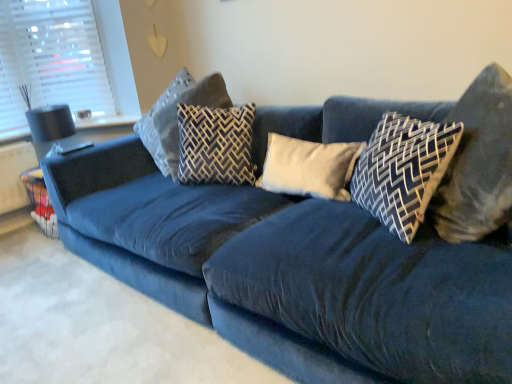
Question: Which is correct: white plastic blinds at upper left is inside dark gray fabric pillow at center, acting as the 5th pillow starting from the right, or outside of it?

Choices:
 (A) inside
 (B) outside

Answer: (B)

Question: Based on their sizes in the image, would you say white plastic blinds at upper left is bigger or smaller than dark gray fabric pillow at center, acting as the 5th pillow starting from the right?

Choices:
 (A) small
 (B) big

Answer: (A)

Question: Estimate the real-world distances between objects in this image. Which object is closer to the dark blue fabric pillow at center, which ranks as the 2th pillow in right-to-left order?

Choices:
 (A) patterned fabric pillow at center, the fourth pillow viewed from the right
 (B) dark blue fabric pillow at upper right, which is the first pillow from right to left
 (C) white soft cushion at center, which is the third pillow from right to left
 (D) dark gray fabric pillow at center, acting as the 5th pillow starting from the right
 (E) white plastic blinds at upper left

Answer: (B)

Question: Considering the real-world distances, which object is farthest from the dark gray fabric pillow at center, acting as the 5th pillow starting from the right?

Choices:
 (A) dark blue fabric pillow at center, which ranks as the 2th pillow in right-to-left order
 (B) white soft cushion at center, acting as the 3th pillow starting from the left
 (C) white plastic blinds at upper left
 (D) patterned fabric pillow at center, marked as the 2th pillow in a left-to-right arrangement
 (E) dark blue fabric pillow at upper right, positioned as the fifth pillow in left-to-right order

Answer: (E)